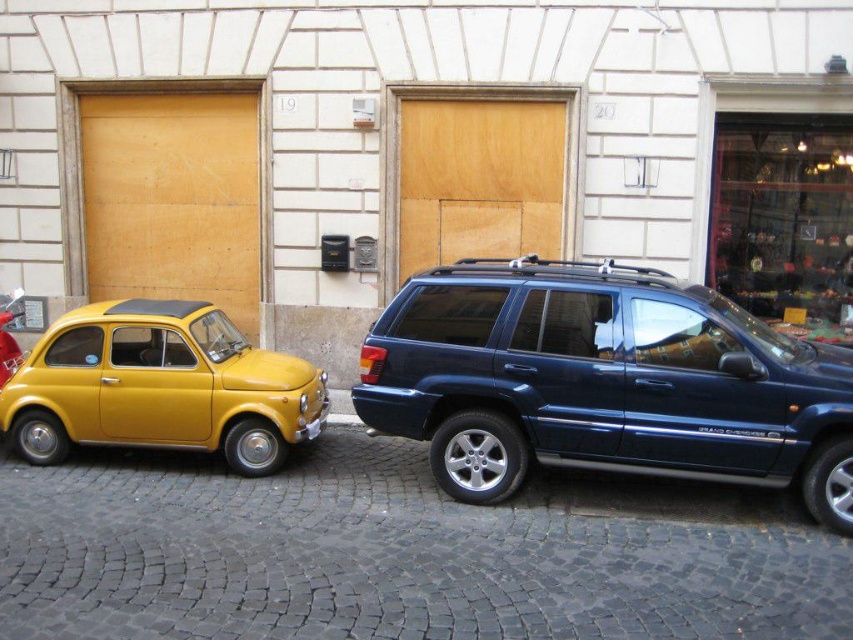
You are standing in front of the building with the numbered doors. You notice two points marked on the ground. Which point, point (412, 369) or point (393, 90), is closer to you?

Point (412, 369) is closer to you than point (393, 90).